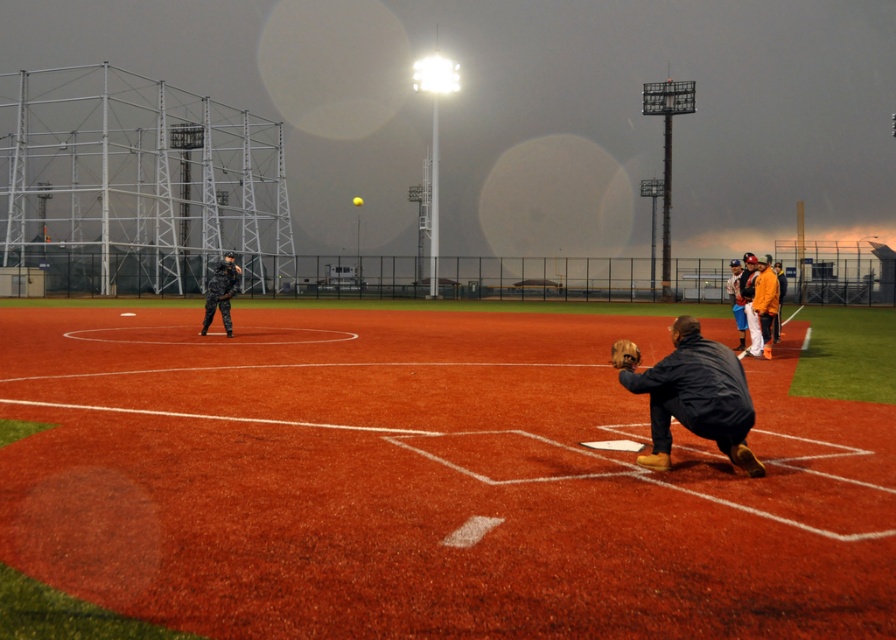
Question: Which object is closer to the camera taking this photo?

Choices:
 (A) dark blue jacket at lower right
 (B) yellow matte baseball at center
 (C) camouflage uniform at center
 (D) rubberized orange turf at center

Answer: (D)

Question: Observing the image, what is the correct spatial positioning of rubberized orange turf at center in reference to camouflage uniform at center?

Choices:
 (A) below
 (B) above

Answer: (A)

Question: Is brown leather baseball glove at lower center bigger than yellow matte baseball at center?

Choices:
 (A) no
 (B) yes

Answer: (A)

Question: Which point is closer to the camera?

Choices:
 (A) rubberized orange turf at center
 (B) brown leather baseball glove at lower center

Answer: (A)

Question: Does dark blue jacket at lower right have a larger size compared to camouflage uniform at center?

Choices:
 (A) yes
 (B) no

Answer: (B)

Question: Considering the real-world distances, which object is farthest from the brown leather baseball glove at lower center?

Choices:
 (A) dark blue jacket at lower right
 (B) rubberized orange turf at center
 (C) yellow matte baseball at center

Answer: (C)